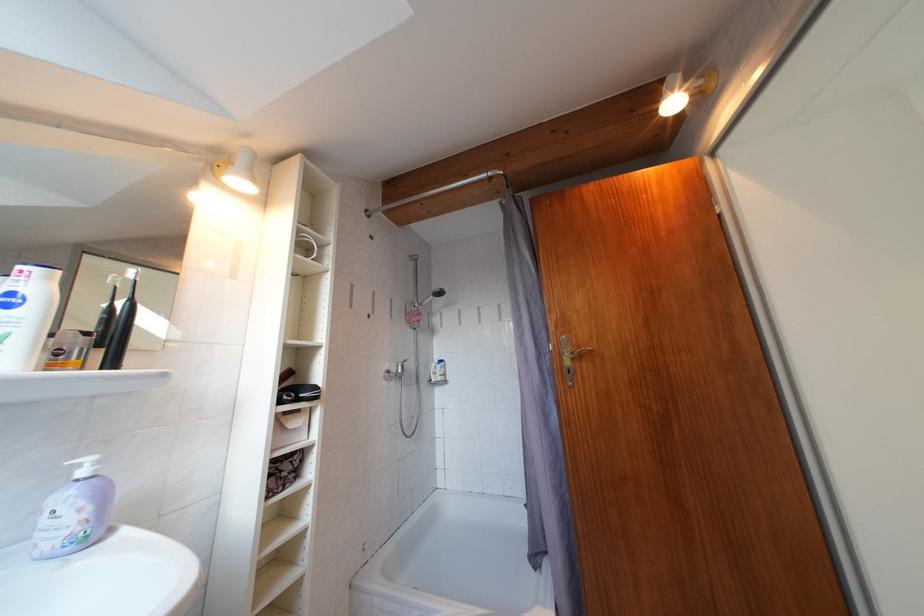
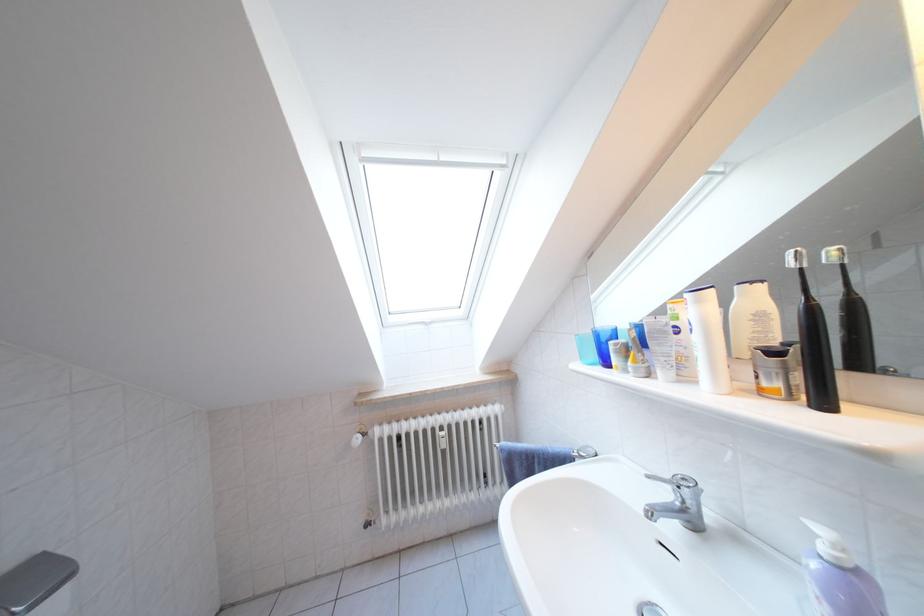
Where in the second image is the point corresponding to the point at 56,283 from the first image?

(708, 306)